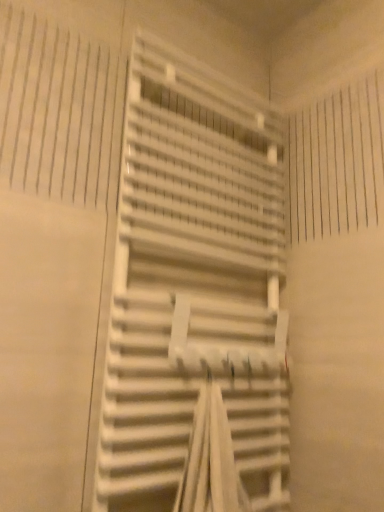
This screenshot has height=512, width=384. What do you see at coordinates (194, 283) in the screenshot?
I see `white plastic radiator at center` at bounding box center [194, 283].

What is the approximate width of white plastic radiator at center?

The width of white plastic radiator at center is 6.76 inches.

Locate an element on the screen. white plastic radiator at center is located at coordinates point(194,283).

Measure the distance between white plastic radiator at center and camera.

A distance of 30.08 inches exists between white plastic radiator at center and camera.

I want to click on white plastic radiator at center, so click(x=194, y=283).